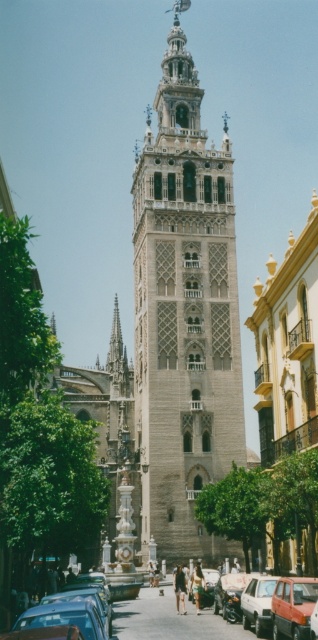
Question: Does stone tower at center appear under matte red car at center?

Choices:
 (A) no
 (B) yes

Answer: (A)

Question: Which point is closer to the camera taking this photo?

Choices:
 (A) (271, 616)
 (B) (42, 605)

Answer: (B)

Question: Which object is farther from the camera taking this photo?

Choices:
 (A) matte blue sedan at lower left
 (B) matte red car at center

Answer: (B)

Question: Can you confirm if matte blue sedan at lower left is smaller than orange matte car at center?

Choices:
 (A) yes
 (B) no

Answer: (B)

Question: Which of these objects is positioned closest to the orange matte car at center?

Choices:
 (A) stone tower at center
 (B) matte silver car at center

Answer: (B)

Question: Does matte blue sedan at lower left appear on the left side of matte red car at center?

Choices:
 (A) no
 (B) yes

Answer: (B)